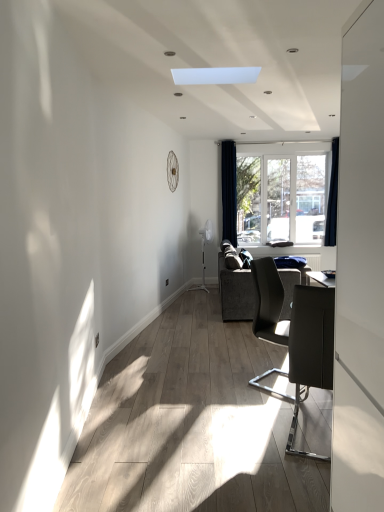
The height and width of the screenshot is (512, 384). I want to click on free area behind matte black chair at center right, positioned as the first chair in back-to-front order, so click(259, 355).